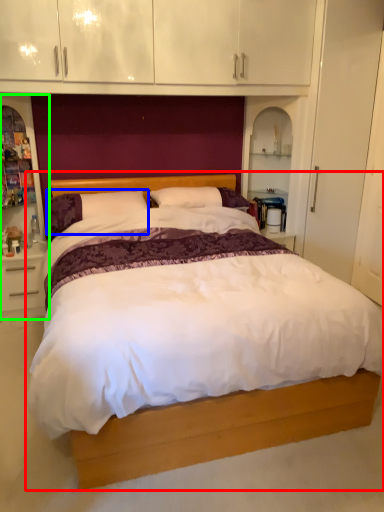
Question: Estimate the real-world distances between objects in this image. Which object is farther from bed (highlighted by a red box), pillow (highlighted by a blue box) or dresser (highlighted by a green box)?

Choices:
 (A) pillow
 (B) dresser

Answer: (B)